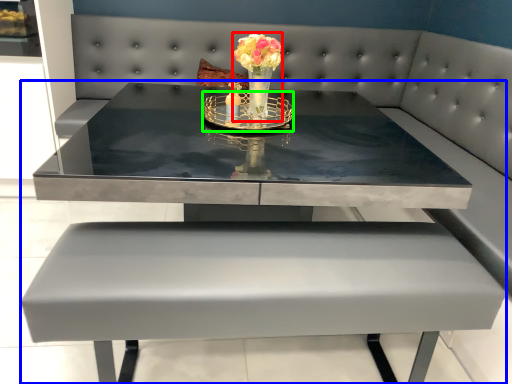
Question: Which object is positioned farthest from floral arrangement (highlighted by a red box)? Select from table (highlighted by a blue box) and candle holder (highlighted by a green box).

Choices:
 (A) table
 (B) candle holder

Answer: (A)